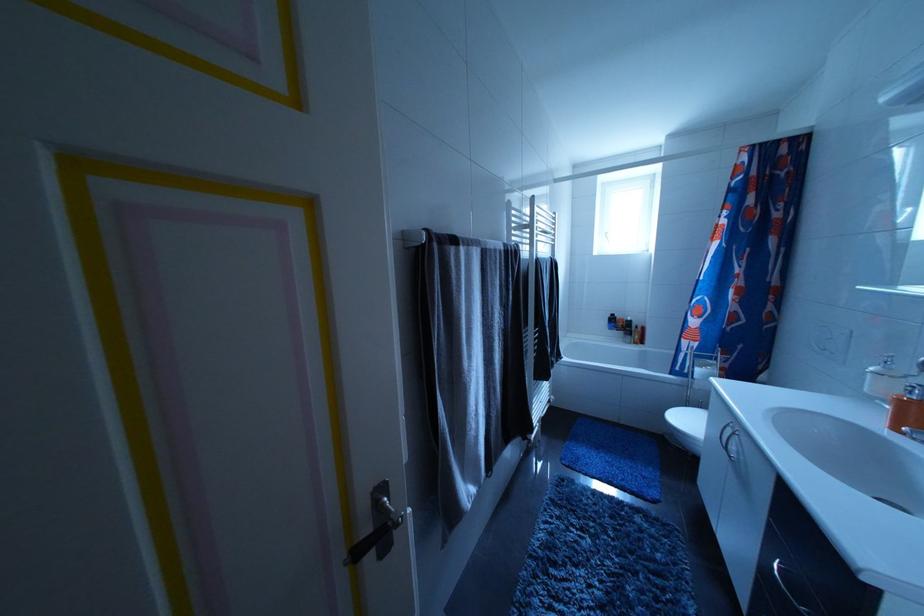
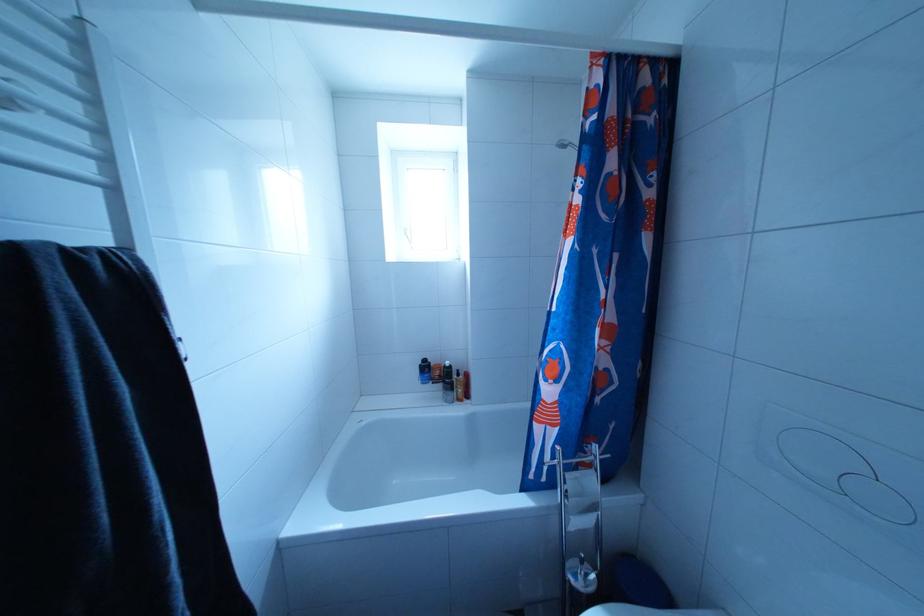
Find the pixel in the second image that matches the point at 635,339 in the first image.

(455, 395)